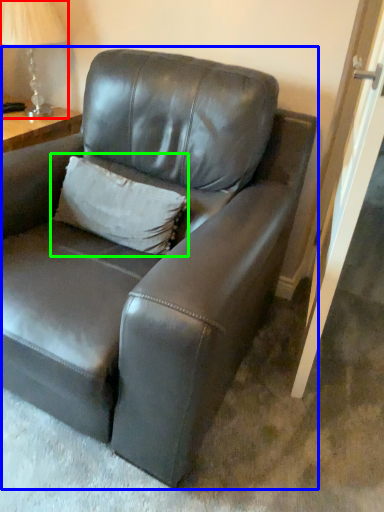
Question: Considering the real-world distances, which object is closest to table lamp (highlighted by a red box)? studio couch (highlighted by a blue box) or pillow (highlighted by a green box).

Choices:
 (A) studio couch
 (B) pillow

Answer: (B)